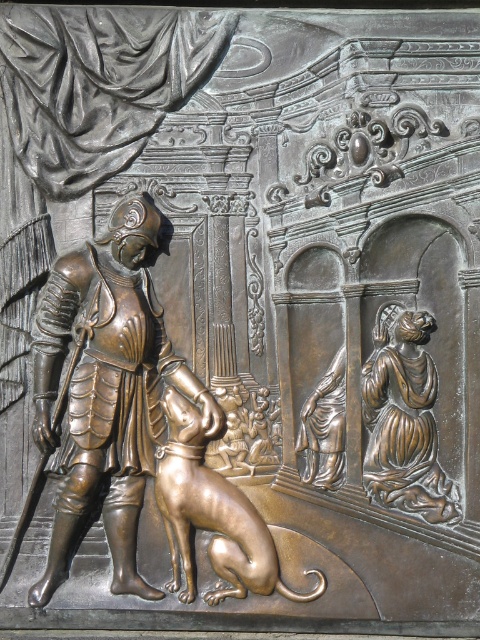
Question: Which point is farther to the camera?

Choices:
 (A) bronze armor at left
 (B) bronze statue of woman at center

Answer: (B)

Question: Which of the following is the closest to the observer?

Choices:
 (A) bronze armor at left
 (B) bronze statue of woman at lower right
 (C) bronze statue of woman at center

Answer: (A)

Question: Which object appears farthest from the camera in this image?

Choices:
 (A) bronze statue of woman at center
 (B) bronze armor at left
 (C) bronze statue of woman at lower right

Answer: (A)

Question: Is bronze armor at left below bronze statue of woman at lower right?

Choices:
 (A) yes
 (B) no

Answer: (B)

Question: Is bronze statue of woman at lower right to the left of bronze statue of woman at center from the viewer's perspective?

Choices:
 (A) no
 (B) yes

Answer: (A)

Question: Does bronze armor at left lie behind bronze statue of woman at lower right?

Choices:
 (A) yes
 (B) no

Answer: (B)